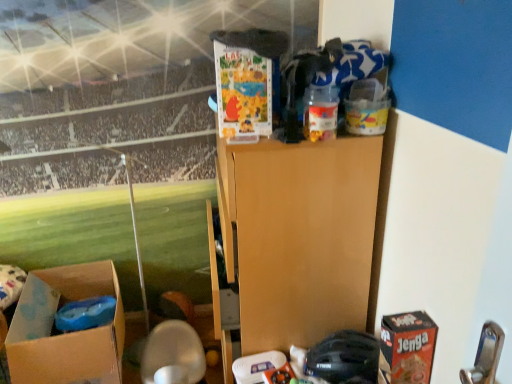
What is the approximate width of brown cardboard box at lower left, which ranks as the second box in top-to-bottom order?

25.03 inches.

The width and height of the screenshot is (512, 384). I want to click on brown cardboard box at lower left, which appears as the first box when viewed from the back, so click(x=66, y=333).

Image resolution: width=512 pixels, height=384 pixels. Describe the element at coordinates (243, 94) in the screenshot. I see `matte cardboard box at upper center, positioned as the second box in left-to-right order` at that location.

What do you see at coordinates (320, 112) in the screenshot? This screenshot has width=512, height=384. I see `translucent plastic container at upper center, acting as the 2th toy starting from the bottom` at bounding box center [320, 112].

At what (x,y) coordinates should I click in order to perform the action: click on brown cardboard box at lower left, which is the second box from right to left. Please return your answer as a coordinate pair (x, y). Image resolution: width=512 pixels, height=384 pixels. Looking at the image, I should click on (66, 333).

Can you see brown cardboard box at lower left, arranged as the first box when viewed from the left, touching translucent plastic container at upper center, arranged as the 2th toy when viewed from the back?

No.

Between brown cardboard box at lower left, which appears as the first box when viewed from the back, and translucent plastic container at upper center, arranged as the 2th toy when viewed from the back, which one is positioned in front?

translucent plastic container at upper center, arranged as the 2th toy when viewed from the back, is closer to the camera.

Is brown cardboard box at lower left, the second box viewed from the front, smaller than translucent plastic container at upper center, arranged as the 2th toy when viewed from the back?

No, brown cardboard box at lower left, the second box viewed from the front, is not smaller than translucent plastic container at upper center, arranged as the 2th toy when viewed from the back.

Based on the photo, how many degrees apart are the facing directions of brown cardboard box at lower left, which appears as the first box when viewed from the back, and translucent plastic container at upper center, which ranks as the 1th toy in front-to-back order?

The angular difference between brown cardboard box at lower left, which appears as the first box when viewed from the back, and translucent plastic container at upper center, which ranks as the 1th toy in front-to-back order, is 100 degrees.

Considering the sizes of brown cardboard box at lower left, arranged as the first box when viewed from the left, and red cardboard jenga box at lower right in the image, is brown cardboard box at lower left, arranged as the first box when viewed from the left, taller or shorter than red cardboard jenga box at lower right?

In the image, brown cardboard box at lower left, arranged as the first box when viewed from the left, appears to be taller than red cardboard jenga box at lower right.

From a real-world perspective, between brown cardboard box at lower left, which is the second box from right to left, and red cardboard jenga box at lower right, who is vertically higher?

red cardboard jenga box at lower right, from a real-world perspective.

From the image's perspective, who appears lower, brown cardboard box at lower left, arranged as the first box when viewed from the left, or red cardboard jenga box at lower right?

brown cardboard box at lower left, arranged as the first box when viewed from the left.

Is brown cardboard box at lower left, the second box viewed from the front, with red cardboard jenga box at lower right?

No, brown cardboard box at lower left, the second box viewed from the front, is not making contact with red cardboard jenga box at lower right.

Would you say matte cardboard box at upper center, marked as the first box in a top-to-bottom arrangement, is inside or outside brown cardboard box at lower left, acting as the 1th box starting from the bottom?

matte cardboard box at upper center, marked as the first box in a top-to-bottom arrangement, lies outside brown cardboard box at lower left, acting as the 1th box starting from the bottom.

From the image's perspective, would you say matte cardboard box at upper center, positioned as the second box in left-to-right order, is shown under brown cardboard box at lower left, the second box viewed from the front?

No, from the image's perspective, matte cardboard box at upper center, positioned as the second box in left-to-right order, is not beneath brown cardboard box at lower left, the second box viewed from the front.

Considering the relative sizes of matte cardboard box at upper center, which is the 2th box from bottom to top, and brown cardboard box at lower left, the second box viewed from the front, in the image provided, is matte cardboard box at upper center, which is the 2th box from bottom to top, taller than brown cardboard box at lower left, the second box viewed from the front,?

No, matte cardboard box at upper center, which is the 2th box from bottom to top, is not taller than brown cardboard box at lower left, the second box viewed from the front.

This screenshot has width=512, height=384. I want to click on box behind the matte cardboard box at upper center, arranged as the 1th box when viewed from the front, so click(x=66, y=333).

Can you tell me how much translucent plastic container at upper center, arranged as the first toy when viewed from the top, and matte cardboard box at upper center, positioned as the second box in left-to-right order, differ in facing direction?

translucent plastic container at upper center, arranged as the first toy when viewed from the top, and matte cardboard box at upper center, positioned as the second box in left-to-right order, are facing 6.4 degrees away from each other.

From the image's perspective, which is below, translucent plastic container at upper center, which ranks as the 1th toy in front-to-back order, or matte cardboard box at upper center, which is the 2th box from bottom to top?

From the image's view, translucent plastic container at upper center, which ranks as the 1th toy in front-to-back order, is below.

Considering the sizes of objects translucent plastic container at upper center, which ranks as the 1th toy in front-to-back order, and matte cardboard box at upper center, marked as the first box in a top-to-bottom arrangement, in the image provided, who is wider, translucent plastic container at upper center, which ranks as the 1th toy in front-to-back order, or matte cardboard box at upper center, marked as the first box in a top-to-bottom arrangement,?

Wider between the two is matte cardboard box at upper center, marked as the first box in a top-to-bottom arrangement.

Based on the photo, from a real-world perspective, is black matte helmet at lower center, arranged as the first toy when viewed from the back, physically above matte cardboard box at upper center, acting as the first box starting from the right?

No, from a real-world perspective, black matte helmet at lower center, arranged as the first toy when viewed from the back, is not on top of matte cardboard box at upper center, acting as the first box starting from the right.

From the image's perspective, is black matte helmet at lower center, the first toy positioned from the bottom, located above or below matte cardboard box at upper center, which is the 2th box from bottom to top?

black matte helmet at lower center, the first toy positioned from the bottom, is situated lower than matte cardboard box at upper center, which is the 2th box from bottom to top, in the image.

You are a GUI agent. You are given a task and a screenshot of the screen. Output one action in this format:
    pyautogui.click(x=<x>, y=<y>)
    Task: Click on the box in front of the black matte helmet at lower center, the first toy positioned from the bottom
    This screenshot has width=512, height=384.
    Given the screenshot: What is the action you would take?
    pyautogui.click(x=243, y=94)

Is point (377, 343) less distant than point (249, 120)?

No, (377, 343) is behind (249, 120).

Is matte cardboard box at upper center, marked as the first box in a top-to-bottom arrangement, wider than translucent plastic container at upper center, arranged as the first toy when viewed from the top?

Correct, the width of matte cardboard box at upper center, marked as the first box in a top-to-bottom arrangement, exceeds that of translucent plastic container at upper center, arranged as the first toy when viewed from the top.

I want to click on the 1st box behind when counting from the translucent plastic container at upper center, arranged as the first toy when viewed from the top, so click(x=243, y=94).

Does point (217, 68) appear closer or farther from the camera than point (333, 110)?

Point (217, 68) appears to be farther away from the viewer than point (333, 110).

At what (x,y) coordinates should I click in order to perform the action: click on the 2nd toy counting from the left of the red cardboard jenga box at lower right. Please return your answer as a coordinate pair (x, y). Image resolution: width=512 pixels, height=384 pixels. Looking at the image, I should click on (320, 112).

Is red cardboard jenga box at lower right completely or partially inside translucent plastic container at upper center, which ranks as the 1th toy in front-to-back order?

No, red cardboard jenga box at lower right is not inside translucent plastic container at upper center, which ranks as the 1th toy in front-to-back order.

Does translucent plastic container at upper center, arranged as the first toy when viewed from the top, touch red cardboard jenga box at lower right?

No, translucent plastic container at upper center, arranged as the first toy when viewed from the top, is not touching red cardboard jenga box at lower right.

Between translucent plastic container at upper center, arranged as the first toy when viewed from the top, and red cardboard jenga box at lower right, which one has smaller width?

translucent plastic container at upper center, arranged as the first toy when viewed from the top, is thinner.

From the image's perspective, count 2nd toys upward from the brown cardboard box at lower left, which is the second box from right to left, and point to it. Please provide its 2D coordinates.

[(320, 112)]

Starting from the red cardboard jenga box at lower right, which box is the 2nd one to the left? Please provide its 2D coordinates.

[(66, 333)]

Which object lies nearer to the anchor point translucent plastic container at upper center, acting as the 2th toy starting from the bottom, matte cardboard box at upper center, positioned as the second box in left-to-right order, or brown cardboard box at lower left, which appears as the first box when viewed from the back?

The object closer to translucent plastic container at upper center, acting as the 2th toy starting from the bottom, is matte cardboard box at upper center, positioned as the second box in left-to-right order.

Which object lies nearer to the anchor point red cardboard jenga box at lower right, translucent plastic container at upper center, which ranks as the 1th toy in front-to-back order, or matte cardboard box at upper center, which is the 2th box from bottom to top?

Based on the image, translucent plastic container at upper center, which ranks as the 1th toy in front-to-back order, appears to be nearer to red cardboard jenga box at lower right.

Based on their spatial positions, is matte cardboard box at upper center, acting as the first box starting from the right, or black matte helmet at lower center, the 2th toy when ordered from front to back, further from red cardboard jenga box at lower right?

The object further to red cardboard jenga box at lower right is matte cardboard box at upper center, acting as the first box starting from the right.

Which object lies further to the anchor point translucent plastic container at upper center, acting as the 2th toy starting from the bottom, black matte helmet at lower center, arranged as the first toy when viewed from the back, or brown cardboard box at lower left, which is the second box from right to left?

Based on the image, brown cardboard box at lower left, which is the second box from right to left, appears to be further to translucent plastic container at upper center, acting as the 2th toy starting from the bottom.

Looking at the image, which one is located further to red cardboard jenga box at lower right, translucent plastic container at upper center, arranged as the first toy when viewed from the top, or black matte helmet at lower center, arranged as the first toy when viewed from the back?

Among the two, translucent plastic container at upper center, arranged as the first toy when viewed from the top, is located further to red cardboard jenga box at lower right.

From the image, which object appears to be nearer to matte cardboard box at upper center, which is the 2th box from bottom to top, translucent plastic container at upper center, which ranks as the 1th toy in front-to-back order, or brown cardboard box at lower left, acting as the 1th box starting from the bottom?

translucent plastic container at upper center, which ranks as the 1th toy in front-to-back order.

Considering their positions, is matte cardboard box at upper center, the 2th box viewed from the back, positioned closer to black matte helmet at lower center, arranged as the first toy when viewed from the back, than translucent plastic container at upper center, acting as the 2th toy starting from the bottom?

The object closer to black matte helmet at lower center, arranged as the first toy when viewed from the back, is translucent plastic container at upper center, acting as the 2th toy starting from the bottom.

When comparing their distances from red cardboard jenga box at lower right, does matte cardboard box at upper center, positioned as the second box in left-to-right order, or brown cardboard box at lower left, which ranks as the second box in top-to-bottom order, seem closer?

The object closer to red cardboard jenga box at lower right is matte cardboard box at upper center, positioned as the second box in left-to-right order.

I want to click on box situated between brown cardboard box at lower left, arranged as the first box when viewed from the left, and translucent plastic container at upper center, acting as the 2th toy starting from the bottom, from left to right, so click(x=243, y=94).

Locate an element on the screen. The height and width of the screenshot is (384, 512). cardboard box between translucent plastic container at upper center, acting as the 2th toy starting from the bottom, and black matte helmet at lower center, the first toy positioned from the bottom, vertically is located at coordinates (409, 346).

Image resolution: width=512 pixels, height=384 pixels. I want to click on toy that lies between matte cardboard box at upper center, marked as the first box in a top-to-bottom arrangement, and black matte helmet at lower center, the 2th toy viewed from the top, from top to bottom, so click(320, 112).

Identify the location of box between brown cardboard box at lower left, the second box viewed from the front, and red cardboard jenga box at lower right, in the horizontal direction. Image resolution: width=512 pixels, height=384 pixels. (243, 94).